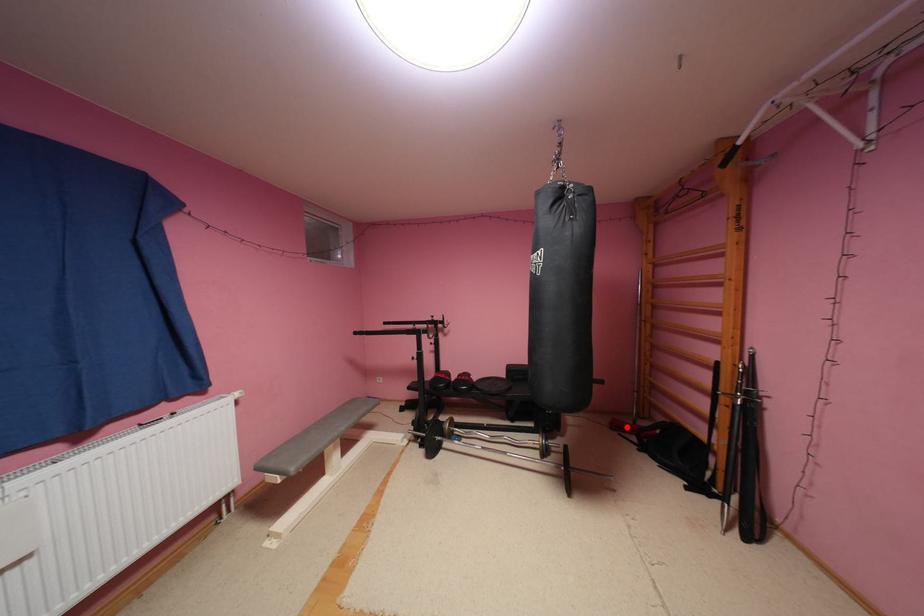
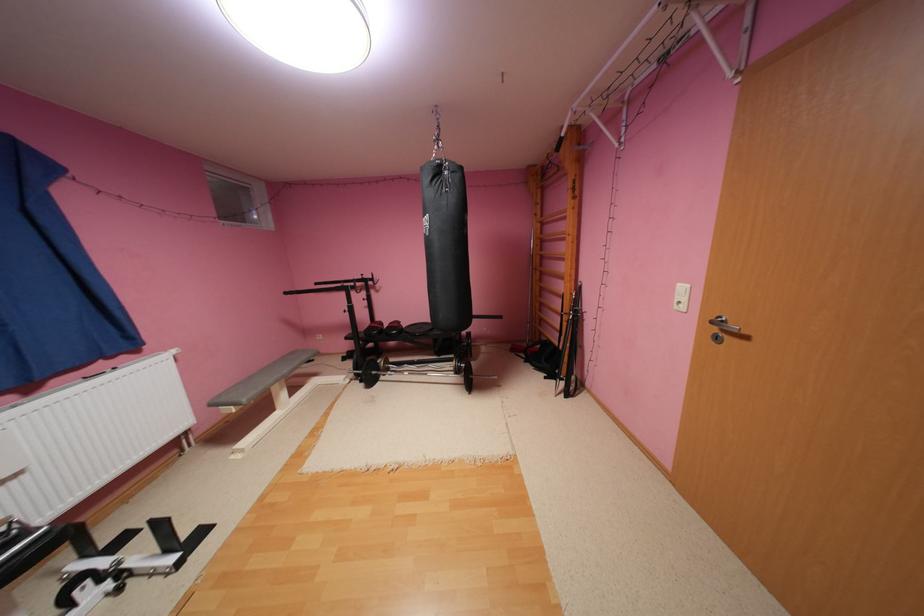
Where in the second image is the point corresponding to the highlighted location from the first image?

(524, 350)